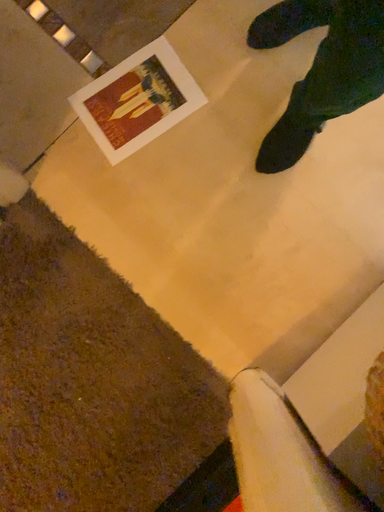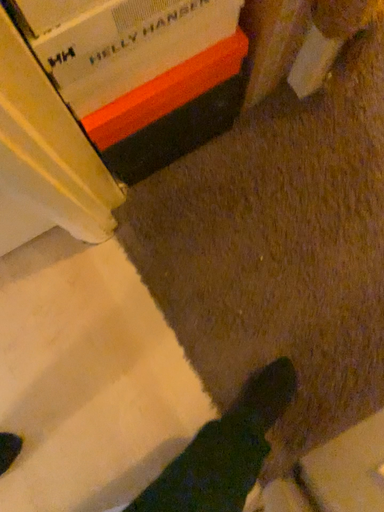
Question: How did the camera likely rotate when shooting the video?

Choices:
 (A) rotated upward
 (B) rotated downward

Answer: (A)